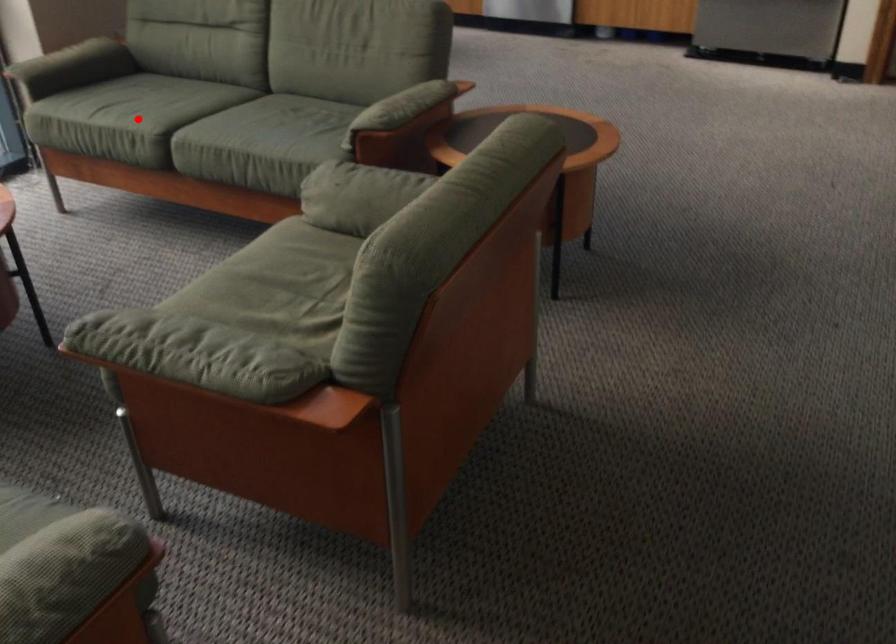
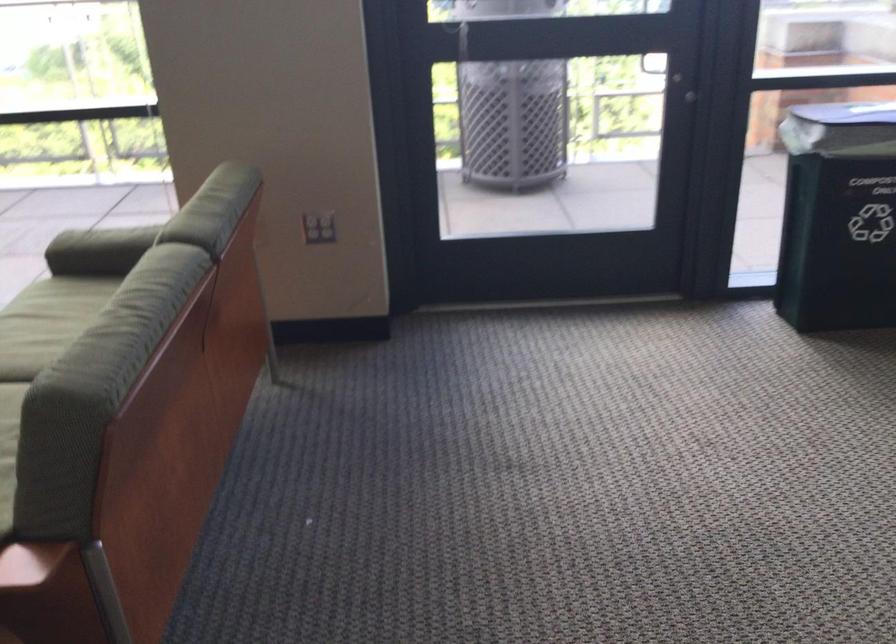
Where in the second image is the point corresponding to the highlighted location from the first image?

(46, 323)